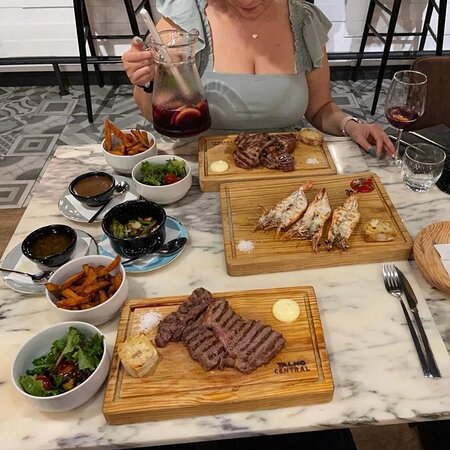
Where is `utensils`? The image size is (450, 450). utensils is located at coordinates pos(400,306), pos(424,344), pos(31,273), pos(176,244), pos(122,189).